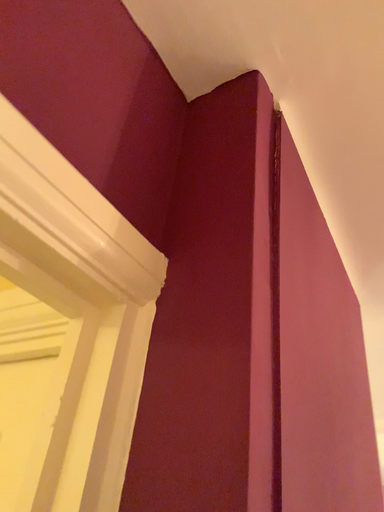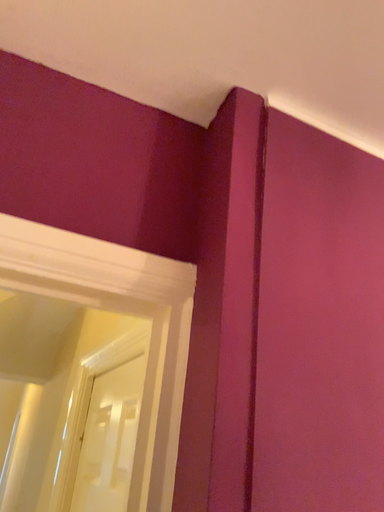
Question: How did the camera likely rotate when shooting the video?

Choices:
 (A) rotated left
 (B) rotated right

Answer: (A)